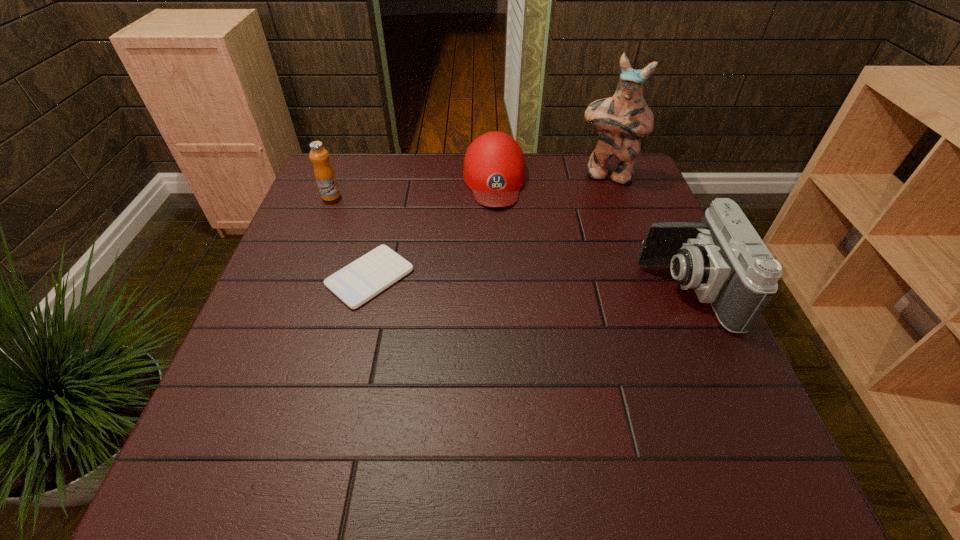
The height and width of the screenshot is (540, 960). In order to click on vacant region at the near edge in this screenshot , I will do `click(446, 387)`.

Image resolution: width=960 pixels, height=540 pixels. In the image, there is a desktop. What are the coordinates of `vacant region at the left edge` in the screenshot? It's located at (340, 222).

The width and height of the screenshot is (960, 540). In the image, there is a desktop. Find the location of `vacant space at the right edge`. vacant space at the right edge is located at coordinates (647, 220).

Locate an element on the screen. This screenshot has width=960, height=540. vacant space that's between the second object from left to right and the camera is located at coordinates (528, 284).

Find the location of a particular element. empty location between the figurine and the camera is located at coordinates (646, 232).

The image size is (960, 540). Identify the location of vacant space that's between the camera and the tallest object. (646, 232).

You are a GUI agent. You are given a task and a screenshot of the screen. Output one action in this format:
    pyautogui.click(x=<x>, y=<y>)
    Task: Click on the free space between the third object from right to left and the calculator
    This screenshot has width=960, height=540.
    Given the screenshot: What is the action you would take?
    pyautogui.click(x=432, y=228)

Where is `vacant space in between the calculator and the leftmost object`? Image resolution: width=960 pixels, height=540 pixels. vacant space in between the calculator and the leftmost object is located at coordinates (350, 237).

The height and width of the screenshot is (540, 960). In order to click on free point between the fourth object from right to left and the camera in this screenshot , I will do `click(528, 284)`.

This screenshot has width=960, height=540. Identify the location of free spot between the second object from left to right and the tallest object. (488, 226).